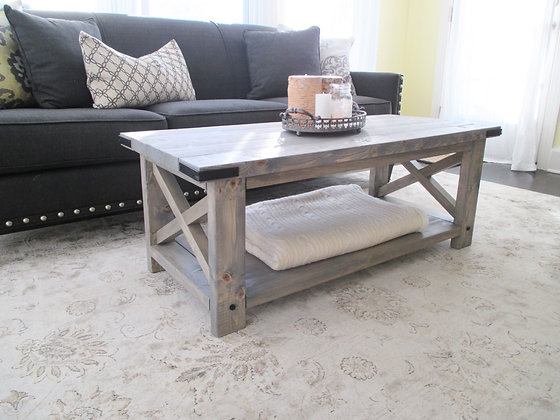
Locate an element on the screen. carpet is located at coordinates (354, 370).